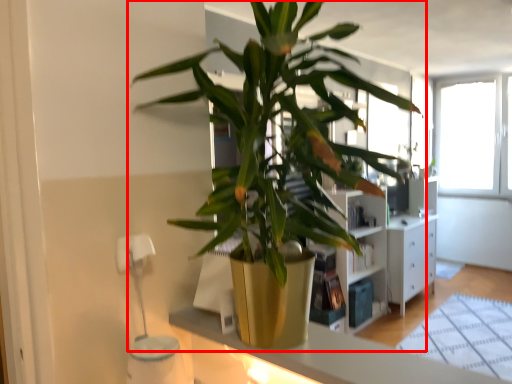
Question: From the image's perspective, considering the relative positions of houseplant (annotated by the red box) and counter top in the image provided, where is houseplant (annotated by the red box) located with respect to the staircase?

Choices:
 (A) above
 (B) below

Answer: (A)